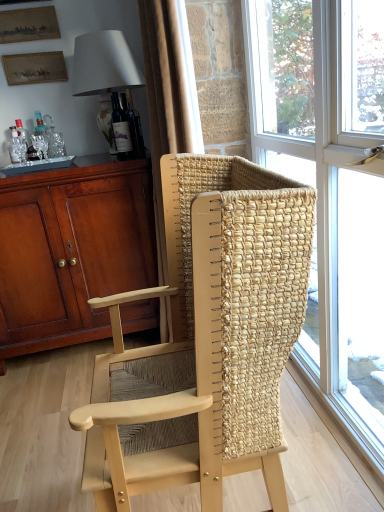
The height and width of the screenshot is (512, 384). What do you see at coordinates (103, 64) in the screenshot?
I see `white fabric lampshade at upper left` at bounding box center [103, 64].

What is the approximate height of translucent glass window at center?

translucent glass window at center is 5.32 feet tall.

What do you see at coordinates (19, 1) in the screenshot? I see `wooden picture frame at upper left, placed as the first picture frame when sorted from top to bottom` at bounding box center [19, 1].

The height and width of the screenshot is (512, 384). In order to click on white fabric lampshade at upper left in this screenshot , I will do `click(103, 64)`.

Does matte gold picture frame at upper left, marked as the second picture frame in a top-to-bottom arrangement, have a lesser width compared to natural wood chair at center?

Yes.

From a real-world perspective, is matte gold picture frame at upper left, marked as the second picture frame in a top-to-bottom arrangement, above or below natural wood chair at center?

From a real-world perspective, matte gold picture frame at upper left, marked as the second picture frame in a top-to-bottom arrangement, is physically above natural wood chair at center.

Is matte gold picture frame at upper left, marked as the second picture frame in a top-to-bottom arrangement, not near natural wood chair at center?

Yes, matte gold picture frame at upper left, marked as the second picture frame in a top-to-bottom arrangement, and natural wood chair at center are located far from each other.

Is white fabric lampshade at upper left wider or thinner than wooden picture frame at upper left, the third picture frame positioned from the top?

white fabric lampshade at upper left is wider than wooden picture frame at upper left, the third picture frame positioned from the top.

Is white fabric lampshade at upper left turned away from wooden picture frame at upper left, the third picture frame positioned from the top?

No, white fabric lampshade at upper left's orientation is not away from wooden picture frame at upper left, the third picture frame positioned from the top.

Can you see white fabric lampshade at upper left touching wooden picture frame at upper left, the third picture frame positioned from the top?

No, white fabric lampshade at upper left is not with wooden picture frame at upper left, the third picture frame positioned from the top.

Can white fabric lampshade at upper left be found inside matte glass bottle at upper center?

No.

Considering the positions of point (115, 126) and point (95, 46), is point (115, 126) closer or farther from the camera than point (95, 46)?

Clearly, point (115, 126) is more distant from the camera than point (95, 46).

Considering the relative positions of matte glass bottle at upper center and white fabric lampshade at upper left in the image provided, is matte glass bottle at upper center to the right of white fabric lampshade at upper left from the viewer's perspective?

Yes.

Between matte glass bottle at upper center and white fabric lampshade at upper left, which one has smaller size?

Smaller between the two is matte glass bottle at upper center.

Between matte brown cabinet at left and matte glass bottle at upper center, which one appears on the right side from the viewer's perspective?

Positioned to the right is matte glass bottle at upper center.

Can you tell me how much matte brown cabinet at left and matte glass bottle at upper center differ in facing direction?

The angular difference between matte brown cabinet at left and matte glass bottle at upper center is 15.6 degrees.

The image size is (384, 512). What are the coordinates of `cabinetry in front of the matte glass bottle at upper center` in the screenshot? It's located at (72, 250).

Image resolution: width=384 pixels, height=512 pixels. I want to click on cabinetry below the white fabric lampshade at upper left (from the image's perspective), so click(x=72, y=250).

Is matte brown cabinet at left not inside white fabric lampshade at upper left?

Yes, matte brown cabinet at left is not within white fabric lampshade at upper left.

Does matte brown cabinet at left have a lesser width compared to white fabric lampshade at upper left?

Incorrect, the width of matte brown cabinet at left is not less than that of white fabric lampshade at upper left.

Is matte brown cabinet at left bigger or smaller than white fabric lampshade at upper left?

matte brown cabinet at left is bigger than white fabric lampshade at upper left.

How many degrees apart are the facing directions of matte gold picture frame at upper left, which appears as the second picture frame when ordered from the bottom, and wooden picture frame at upper left, marked as the third picture frame in a bottom-to-top arrangement?

The angle between the facing direction of matte gold picture frame at upper left, which appears as the second picture frame when ordered from the bottom, and the facing direction of wooden picture frame at upper left, marked as the third picture frame in a bottom-to-top arrangement, is 0.194 degrees.

Between matte gold picture frame at upper left, which appears as the second picture frame when ordered from the bottom, and wooden picture frame at upper left, placed as the first picture frame when sorted from top to bottom, which one has larger size?

With larger size is wooden picture frame at upper left, placed as the first picture frame when sorted from top to bottom.

Locate an element on the screen. This screenshot has width=384, height=512. picture frame above the matte gold picture frame at upper left, marked as the second picture frame in a top-to-bottom arrangement (from a real-world perspective) is located at coordinates (19, 1).

Are matte gold picture frame at upper left, marked as the second picture frame in a top-to-bottom arrangement, and wooden picture frame at upper left, marked as the third picture frame in a bottom-to-top arrangement, far apart?

No, matte gold picture frame at upper left, marked as the second picture frame in a top-to-bottom arrangement, is not far away from wooden picture frame at upper left, marked as the third picture frame in a bottom-to-top arrangement.

Is translucent glass window at center oriented towards white fabric lampshade at upper left?

No, translucent glass window at center does not turn towards white fabric lampshade at upper left.

Is translucent glass window at center in front of white fabric lampshade at upper left?

Yes, it is.

Is translucent glass window at center thinner than white fabric lampshade at upper left?

Correct, the width of translucent glass window at center is less than that of white fabric lampshade at upper left.

Identify the location of chair located in front of the matte gold picture frame at upper left, marked as the second picture frame in a top-to-bottom arrangement. (211, 339).

Where is `picture frame that is the 3rd one when counting backward from the white fabric lampshade at upper left`? The width and height of the screenshot is (384, 512). picture frame that is the 3rd one when counting backward from the white fabric lampshade at upper left is located at coordinates (35, 68).

When comparing their distances from white fabric lampshade at upper left, does matte gold picture frame at upper left, which appears as the second picture frame when ordered from the bottom, or wooden picture frame at upper left, placed as the first picture frame when sorted from top to bottom, seem closer?

The object closer to white fabric lampshade at upper left is matte gold picture frame at upper left, which appears as the second picture frame when ordered from the bottom.

From the image, which object appears to be nearer to matte glass bottle at upper center, matte brown cabinet at left or wooden picture frame at upper left, the third picture frame positioned from the top?

Based on the image, wooden picture frame at upper left, the third picture frame positioned from the top, appears to be nearer to matte glass bottle at upper center.

Which object lies further to the anchor point wooden picture frame at upper left, the third picture frame positioned from the top, matte brown cabinet at left or white fabric lampshade at upper left?

Based on the image, matte brown cabinet at left appears to be further to wooden picture frame at upper left, the third picture frame positioned from the top.

Which object lies further to the anchor point matte glass bottle at upper center, wooden picture frame at upper left, marked as the third picture frame in a bottom-to-top arrangement, or white fabric lampshade at upper left?

wooden picture frame at upper left, marked as the third picture frame in a bottom-to-top arrangement, lies further to matte glass bottle at upper center than the other object.

When comparing their distances from wooden picture frame at upper left, the third picture frame positioned from the top, does matte glass bottle at upper center or wooden picture frame at upper left, placed as the first picture frame when sorted from top to bottom, seem further?

matte glass bottle at upper center is further to wooden picture frame at upper left, the third picture frame positioned from the top.

From the image, which object appears to be farther from natural wood chair at center, wooden picture frame at upper left, positioned as the 1th picture frame in bottom-to-top order, or matte gold picture frame at upper left, which appears as the second picture frame when ordered from the bottom?

matte gold picture frame at upper left, which appears as the second picture frame when ordered from the bottom, is further to natural wood chair at center.

Considering their positions, is translucent glass window at center positioned further to natural wood chair at center than matte brown cabinet at left?

Based on the image, matte brown cabinet at left appears to be further to natural wood chair at center.

Considering their positions, is wooden picture frame at upper left, the third picture frame positioned from the top, positioned closer to matte glass bottle at upper center than translucent glass window at center?

wooden picture frame at upper left, the third picture frame positioned from the top.

Find the location of a particular element. lamp located between translucent glass window at center and wooden picture frame at upper left, marked as the third picture frame in a bottom-to-top arrangement, in the depth direction is located at coordinates (103, 64).

The width and height of the screenshot is (384, 512). I want to click on bottle between translucent glass window at center and matte gold picture frame at upper left, marked as the second picture frame in a top-to-bottom arrangement, along the z-axis, so (121, 130).

Where is `picture frame that lies between matte gold picture frame at upper left, marked as the second picture frame in a top-to-bottom arrangement, and matte brown cabinet at left from top to bottom`? picture frame that lies between matte gold picture frame at upper left, marked as the second picture frame in a top-to-bottom arrangement, and matte brown cabinet at left from top to bottom is located at coordinates (35, 68).

Where is `lamp between wooden picture frame at upper left, positioned as the 1th picture frame in bottom-to-top order, and matte brown cabinet at left, in the vertical direction`? This screenshot has height=512, width=384. lamp between wooden picture frame at upper left, positioned as the 1th picture frame in bottom-to-top order, and matte brown cabinet at left, in the vertical direction is located at coordinates (103, 64).